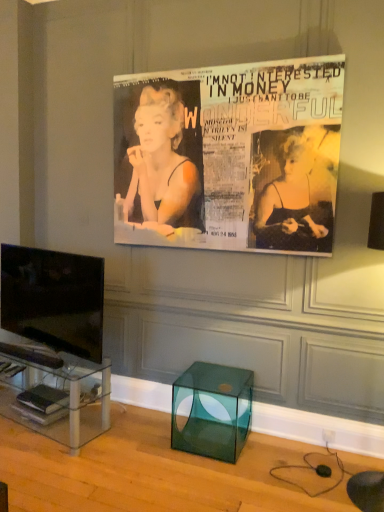
Question: Considering the relative sizes of matte black magazine at lower left, acting as the 1th magazine starting from the top, and hardcover book at lower left, marked as the first magazine in a bottom-to-top arrangement, in the image provided, is matte black magazine at lower left, acting as the 1th magazine starting from the top, shorter than hardcover book at lower left, marked as the first magazine in a bottom-to-top arrangement,?

Choices:
 (A) yes
 (B) no

Answer: (B)

Question: Could you tell me if matte black magazine at lower left, positioned as the third magazine in bottom-to-top order, is turned towards hardcover book at lower left, marked as the first magazine in a bottom-to-top arrangement?

Choices:
 (A) no
 (B) yes

Answer: (A)

Question: Can you confirm if matte black magazine at lower left, acting as the 1th magazine starting from the top, is bigger than hardcover book at lower left, arranged as the 3th magazine when viewed from the top?

Choices:
 (A) yes
 (B) no

Answer: (B)

Question: Is matte black magazine at lower left, positioned as the third magazine in bottom-to-top order, positioned with its back to hardcover book at lower left, marked as the first magazine in a bottom-to-top arrangement?

Choices:
 (A) no
 (B) yes

Answer: (A)

Question: From the image's perspective, is matte black magazine at lower left, acting as the 1th magazine starting from the top, under hardcover book at lower left, marked as the first magazine in a bottom-to-top arrangement?

Choices:
 (A) yes
 (B) no

Answer: (B)

Question: Can you confirm if matte black magazine at lower left, acting as the 1th magazine starting from the top, is wider than hardcover book at lower left, arranged as the 3th magazine when viewed from the top?

Choices:
 (A) no
 (B) yes

Answer: (A)

Question: Does hardcover book at lower left, marked as the first magazine in a bottom-to-top arrangement, have a greater height compared to transparent glass cube at lower center?

Choices:
 (A) no
 (B) yes

Answer: (A)

Question: Is hardcover book at lower left, marked as the first magazine in a bottom-to-top arrangement, at the left side of transparent glass cube at lower center?

Choices:
 (A) no
 (B) yes

Answer: (B)

Question: Does hardcover book at lower left, arranged as the 3th magazine when viewed from the top, have a smaller size compared to transparent glass cube at lower center?

Choices:
 (A) yes
 (B) no

Answer: (A)

Question: From a real-world perspective, is hardcover book at lower left, marked as the first magazine in a bottom-to-top arrangement, physically below transparent glass cube at lower center?

Choices:
 (A) no
 (B) yes

Answer: (B)

Question: Is hardcover book at lower left, marked as the first magazine in a bottom-to-top arrangement, positioned before transparent glass cube at lower center?

Choices:
 (A) yes
 (B) no

Answer: (B)

Question: Can you confirm if matte black poster at upper center is shorter than clear glass tv stand at lower left?

Choices:
 (A) no
 (B) yes

Answer: (A)